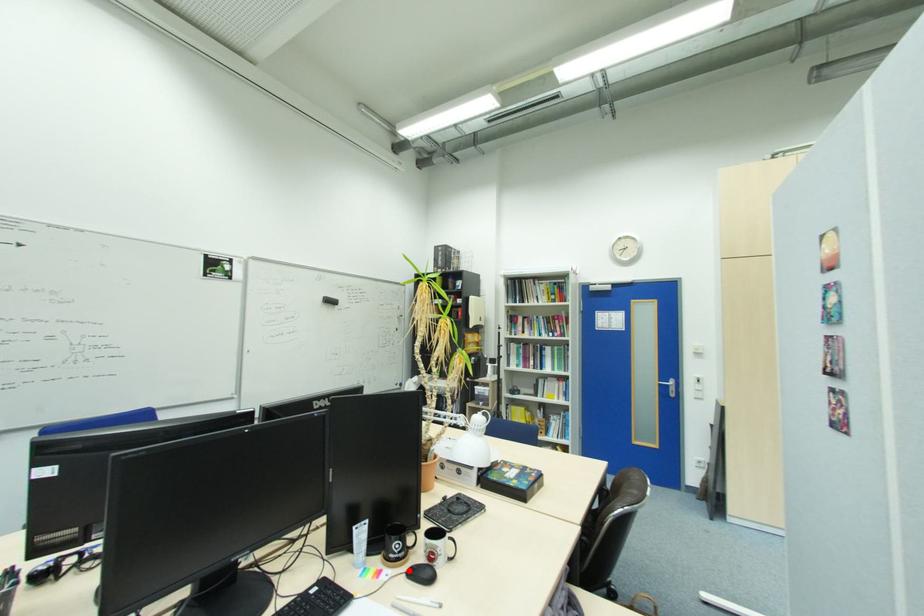
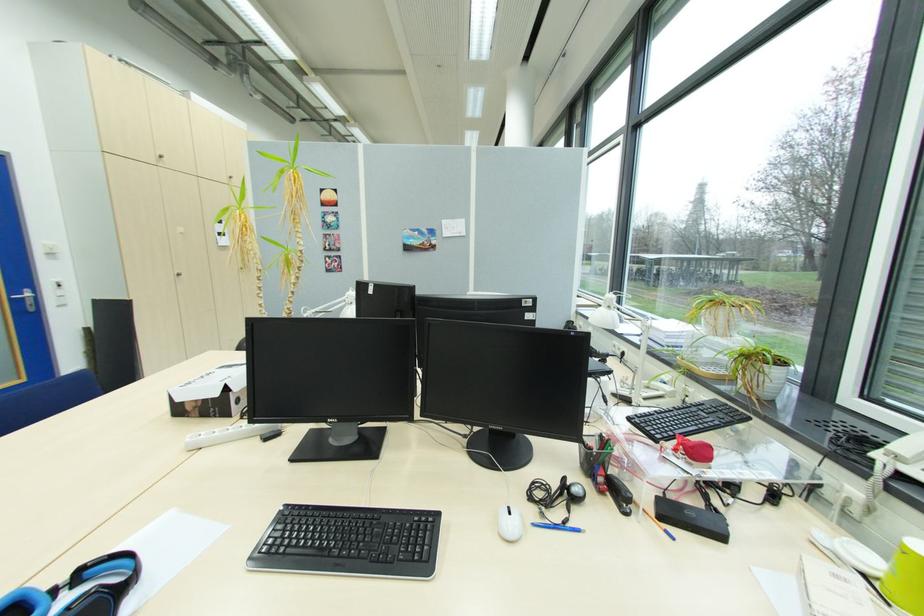
Question: I am providing you with two images of the same scene from different viewpoints. A red point is marked on the first image. Is the red point's position out of view in image 2?

Choices:
 (A) Yes
 (B) No

Answer: (A)